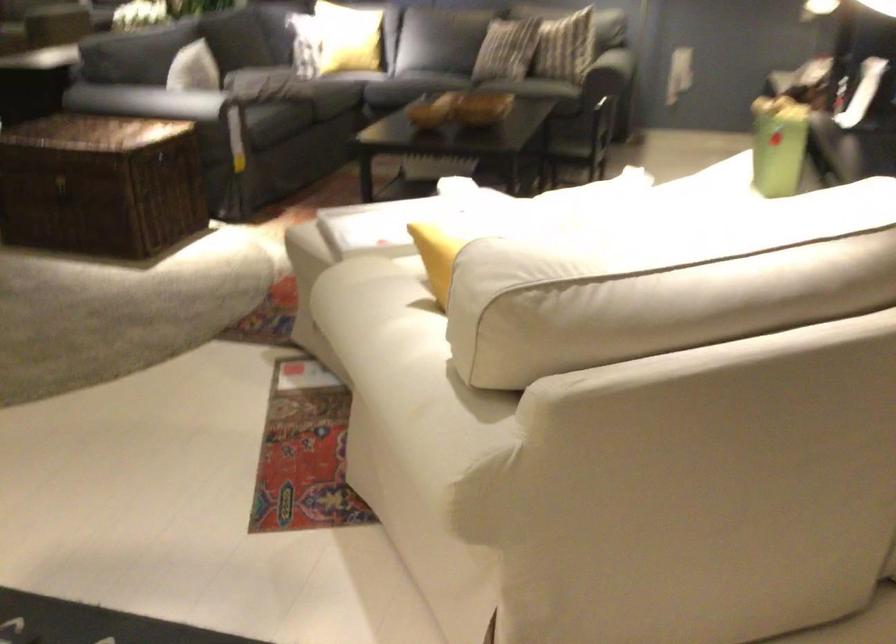
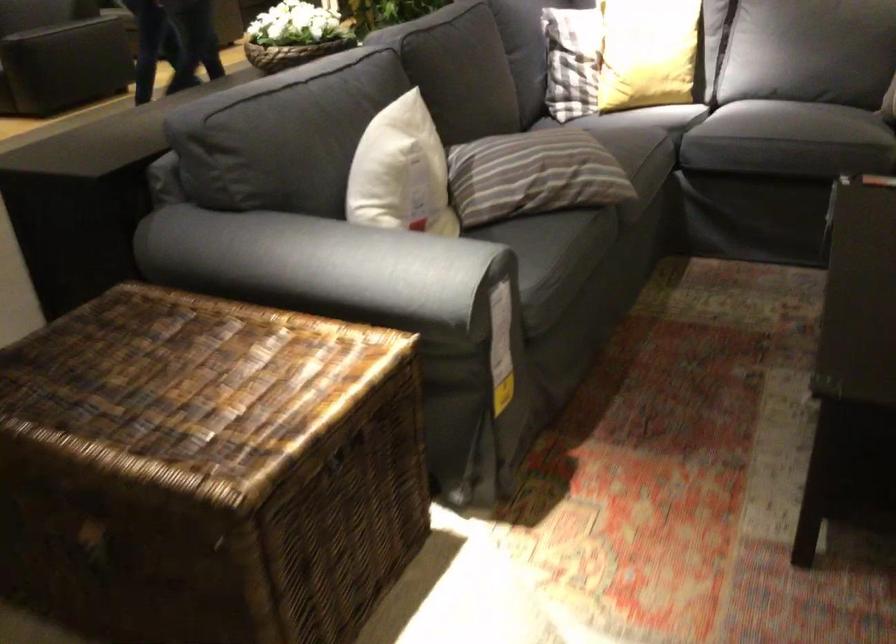
Find the pixel in the second image that matches (x=105, y=131) in the first image.

(195, 389)